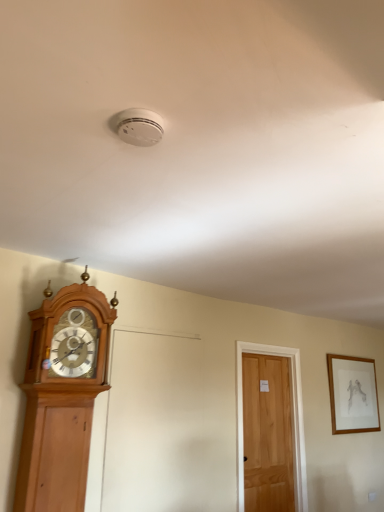
Image resolution: width=384 pixels, height=512 pixels. What do you see at coordinates (62, 396) in the screenshot? I see `light brown wooden clock at left` at bounding box center [62, 396].

Measure the distance between light brown wooden clock at left and camera.

light brown wooden clock at left and camera are 7.38 feet apart.

The width and height of the screenshot is (384, 512). I want to click on light brown wooden door at center-right, so click(x=267, y=434).

This screenshot has height=512, width=384. Identify the location of wall clock in front of the light brown wooden door at center-right. (62, 396).

Does point (73, 287) come farther from viewer compared to point (283, 454)?

That is False.

From the image's perspective, which is below, light brown wooden clock at left or light brown wooden door at center-right?

light brown wooden door at center-right is shown below in the image.

Looking at the image, does light brown wooden clock at left seem bigger or smaller compared to light brown wooden door at center-right?

Considering their sizes, light brown wooden clock at left takes up more space than light brown wooden door at center-right.

Based on the photo, from a real-world perspective, between light brown wooden door at center-right and wooden framed drawing at upper right, who is vertically lower?

light brown wooden door at center-right, from a real-world perspective.

Considering the relative positions of light brown wooden door at center-right and wooden framed drawing at upper right in the image provided, is light brown wooden door at center-right to the right of wooden framed drawing at upper right from the viewer's perspective?

In fact, light brown wooden door at center-right is to the left of wooden framed drawing at upper right.

Who is taller, light brown wooden door at center-right or wooden framed drawing at upper right?

light brown wooden door at center-right is taller.

From the image's perspective, is light brown wooden door at center-right on top of wooden framed drawing at upper right?

No.

In the scene shown: Does light brown wooden door at center-right have a larger size compared to light brown wooden clock at left?

No, light brown wooden door at center-right is not bigger than light brown wooden clock at left.

How distant is light brown wooden door at center-right from light brown wooden clock at left?

They are 6.24 feet apart.

Which object is further away from the camera taking this photo, light brown wooden door at center-right or light brown wooden clock at left?

light brown wooden door at center-right.

Is light brown wooden door at center-right spatially inside light brown wooden clock at left, or outside of it?

light brown wooden door at center-right exists outside the volume of light brown wooden clock at left.

Is wooden framed drawing at upper right positioned with its back to light brown wooden door at center-right?

No, wooden framed drawing at upper right is not facing the opposite direction of light brown wooden door at center-right.

Is wooden framed drawing at upper right wider than light brown wooden door at center-right?

No.

Would you say wooden framed drawing at upper right is inside or outside light brown wooden door at center-right?

wooden framed drawing at upper right cannot be found inside light brown wooden door at center-right.

From a real-world perspective, is wooden framed drawing at upper right physically located above or below light brown wooden door at center-right?

From a real-world perspective, wooden framed drawing at upper right is physically above light brown wooden door at center-right.

In the scene shown: Which point is more distant from viewer, (43, 493) or (340, 417)?

The point (340, 417) is behind.

How far apart are light brown wooden clock at left and wooden framed drawing at upper right?

light brown wooden clock at left and wooden framed drawing at upper right are 3.05 meters apart from each other.

Where is `picture frame below the light brown wooden clock at left (from a real-world perspective)`? picture frame below the light brown wooden clock at left (from a real-world perspective) is located at coordinates (353, 394).

Are light brown wooden clock at left and wooden framed drawing at upper right beside each other?

No, light brown wooden clock at left is not making contact with wooden framed drawing at upper right.

From a real-world perspective, is wooden framed drawing at upper right below light brown wooden clock at left?

Yes.

Who is shorter, wooden framed drawing at upper right or light brown wooden clock at left?

wooden framed drawing at upper right.

Does wooden framed drawing at upper right touch light brown wooden clock at left?

There is a gap between wooden framed drawing at upper right and light brown wooden clock at left.

Based on their sizes in the image, would you say wooden framed drawing at upper right is bigger or smaller than light brown wooden clock at left?

wooden framed drawing at upper right is smaller than light brown wooden clock at left.

Locate an element on the screen. door below the light brown wooden clock at left (from the image's perspective) is located at coordinates (267, 434).

The width and height of the screenshot is (384, 512). In the image, there is a light brown wooden door at center-right. Find the location of `picture frame above it (from the image's perspective)`. picture frame above it (from the image's perspective) is located at coordinates (x=353, y=394).

Which object lies nearer to the anchor point light brown wooden clock at left, wooden framed drawing at upper right or light brown wooden door at center-right?

The object closer to light brown wooden clock at left is light brown wooden door at center-right.

Considering their positions, is light brown wooden clock at left positioned closer to light brown wooden door at center-right than wooden framed drawing at upper right?

wooden framed drawing at upper right.

Which object lies further to the anchor point light brown wooden door at center-right, wooden framed drawing at upper right or light brown wooden clock at left?

light brown wooden clock at left lies further to light brown wooden door at center-right than the other object.

Estimate the real-world distances between objects in this image. Which object is closer to wooden framed drawing at upper right, light brown wooden door at center-right or light brown wooden clock at left?

light brown wooden door at center-right.

When comparing their distances from light brown wooden clock at left, does light brown wooden door at center-right or wooden framed drawing at upper right seem closer?

light brown wooden door at center-right lies closer to light brown wooden clock at left than the other object.

Estimate the real-world distances between objects in this image. Which object is closer to wooden framed drawing at upper right, light brown wooden clock at left or light brown wooden door at center-right?

light brown wooden door at center-right lies closer to wooden framed drawing at upper right than the other object.

You are a GUI agent. You are given a task and a screenshot of the screen. Output one action in this format:
    pyautogui.click(x=<x>, y=<y>)
    Task: Click on the door located between light brown wooden clock at left and wooden framed drawing at upper right in the left-right direction
    The height and width of the screenshot is (512, 384).
    Given the screenshot: What is the action you would take?
    pyautogui.click(x=267, y=434)